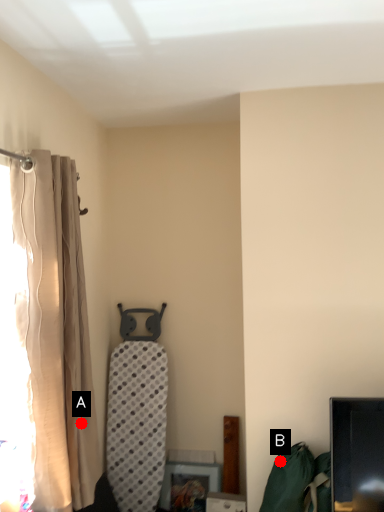
Question: Two points are circled on the image, labeled by A and B beside each circle. Which of the following is the closest to the observer?

Choices:
 (A) A is closer
 (B) B is closer

Answer: (A)